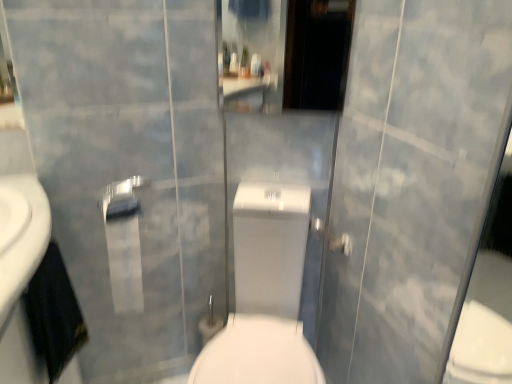
Question: From the image's perspective, is silver metallic towel bar at upper center on matte silver shower at center?

Choices:
 (A) no
 (B) yes

Answer: (B)

Question: Can you confirm if silver metallic towel bar at upper center is shorter than matte silver shower at center?

Choices:
 (A) yes
 (B) no

Answer: (B)

Question: From a real-world perspective, is silver metallic towel bar at upper center positioned over matte silver shower at center based on gravity?

Choices:
 (A) yes
 (B) no

Answer: (A)

Question: Considering the relative positions of silver metallic towel bar at upper center and matte silver shower at center in the image provided, is silver metallic towel bar at upper center to the left of matte silver shower at center from the viewer's perspective?

Choices:
 (A) no
 (B) yes

Answer: (B)

Question: Is the position of silver metallic towel bar at upper center more distant than that of matte silver shower at center?

Choices:
 (A) no
 (B) yes

Answer: (A)

Question: Does silver metallic towel bar at upper center lie in front of matte silver shower at center?

Choices:
 (A) yes
 (B) no

Answer: (A)

Question: Does white glossy toilet at center have a larger size compared to matte silver shower at center?

Choices:
 (A) no
 (B) yes

Answer: (B)

Question: Considering the relative sizes of white glossy toilet at center and matte silver shower at center in the image provided, is white glossy toilet at center smaller than matte silver shower at center?

Choices:
 (A) no
 (B) yes

Answer: (A)

Question: Is white glossy toilet at center positioned in front of matte silver shower at center?

Choices:
 (A) no
 (B) yes

Answer: (B)

Question: From the image's perspective, is white glossy toilet at center over matte silver shower at center?

Choices:
 (A) yes
 (B) no

Answer: (B)

Question: Is white glossy toilet at center oriented towards matte silver shower at center?

Choices:
 (A) yes
 (B) no

Answer: (B)

Question: From the image's perspective, would you say white glossy toilet at center is shown under matte silver shower at center?

Choices:
 (A) yes
 (B) no

Answer: (A)

Question: Could you tell me if silver metallic towel bar at upper center is turned towards white glossy toilet at center?

Choices:
 (A) no
 (B) yes

Answer: (A)